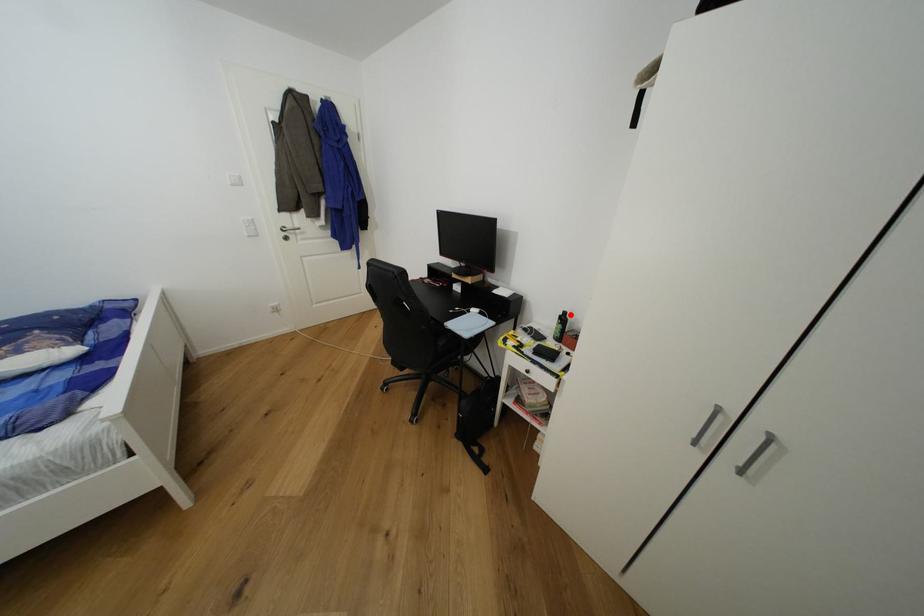
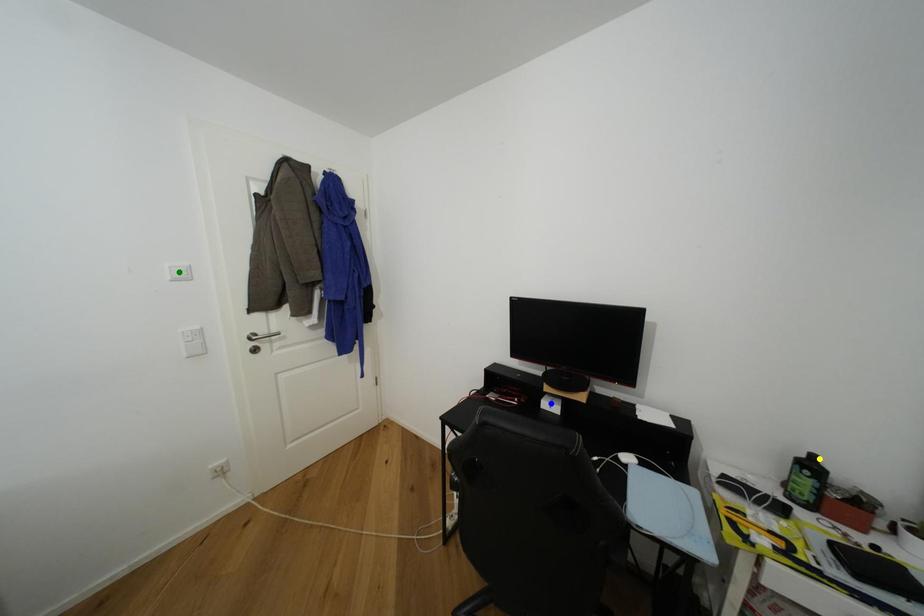
Question: I am providing you with two images of the same scene from different viewpoints. A red point is marked on the first image. You are given multiple points on the second image. Which point in image 2 represents the same 3d spot as the red point in image 1?

Choices:
 (A) green point
 (B) blue point
 (C) yellow point

Answer: (C)